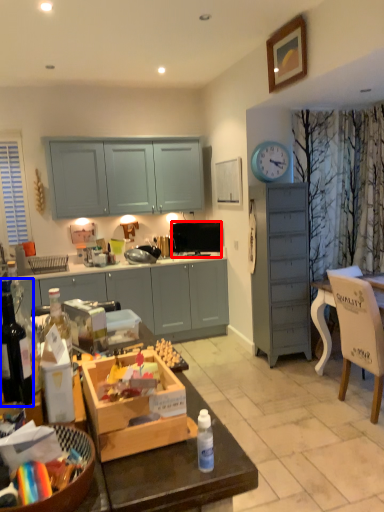
Question: Among these objects, which one is farthest to the camera, television (highlighted by a red box) or bottle (highlighted by a blue box)?

Choices:
 (A) television
 (B) bottle

Answer: (A)